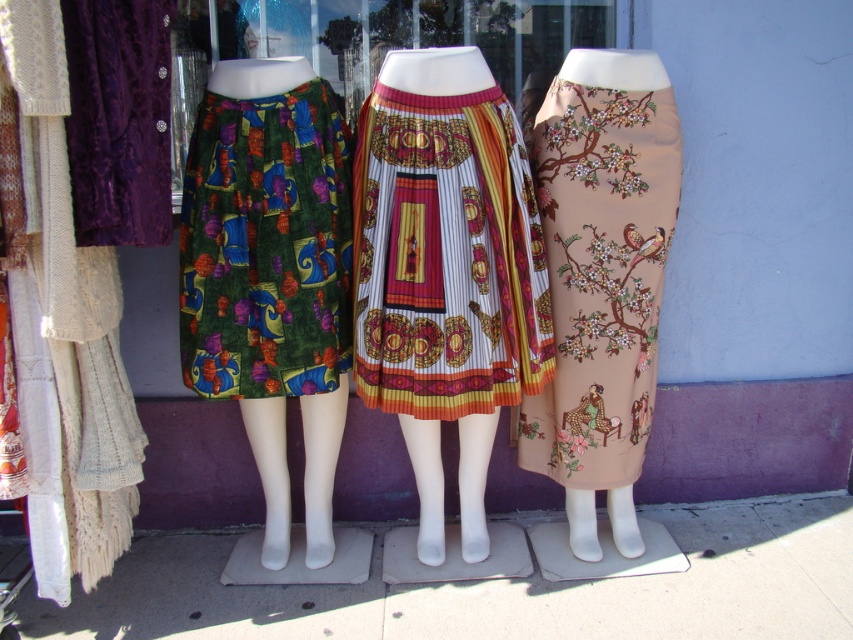
Which is more to the right, printed cotton skirt at center or green velvet skirt at center?

Positioned to the right is printed cotton skirt at center.

Who is lower down, printed cotton skirt at center or green velvet skirt at center?

Positioned lower is printed cotton skirt at center.

Does point (502, 403) lie in front of point (186, 362)?

No, it is not.

The image size is (853, 640). I want to click on printed cotton skirt at center, so click(445, 272).

From the picture: Which of these two, beige floral skirt at center or green velvet skirt at center, stands shorter?

With less height is green velvet skirt at center.

The image size is (853, 640). I want to click on beige floral skirt at center, so click(601, 264).

Identify the location of beige floral skirt at center. This screenshot has height=640, width=853. (601, 264).

Between printed cotton skirt at center and beige floral skirt at center, which one has more height?

With more height is printed cotton skirt at center.

Identify the location of printed cotton skirt at center. The width and height of the screenshot is (853, 640). (445, 272).

Identify the location of printed cotton skirt at center. (445, 272).